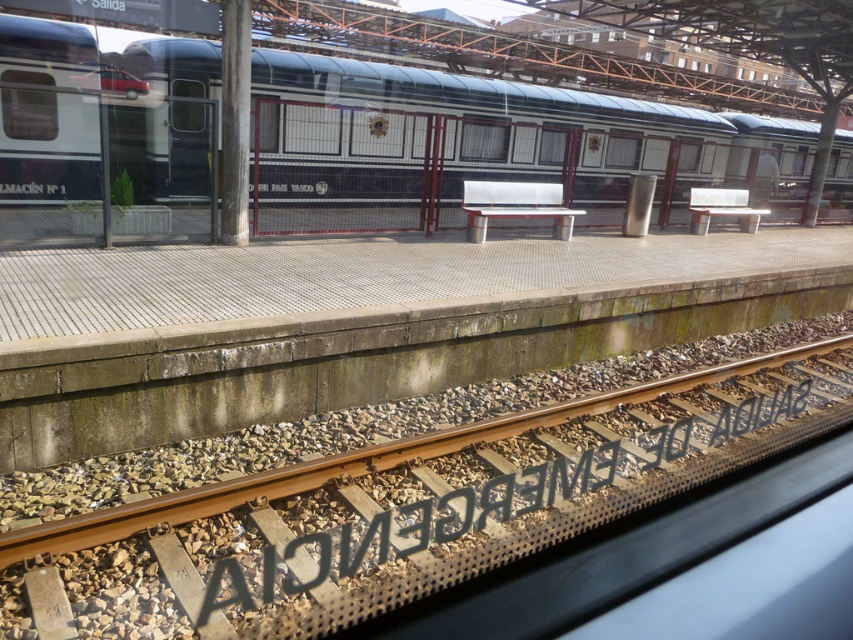
You are standing on the train station platform and want to determine the relative positions of two points marked on the platform. The first point is at coordinates point (181, 525) and the second is at point (711, 157). Which point is closer to you?

Point (181, 525) is closer to the camera than point (711, 157). Therefore, the first point is closer to you.

You are standing at point (422,516) on the platform. What object is directly below you?

The brown gravel track at lower center is directly below the point (422,516).

Looking at this image, you are a maintenance worker on the platform and need to place a 1.2 meter wide equipment box between the brown gravel track at lower center and the polished metal train at center. Can the box fit in that space?

The brown gravel track at lower center is thinner than the polished metal train at center, but the description does not provide exact measurements of their widths. Therefore, it is uncertain if the 1.2 meter wide equipment box will fit between them without more specific spatial data.